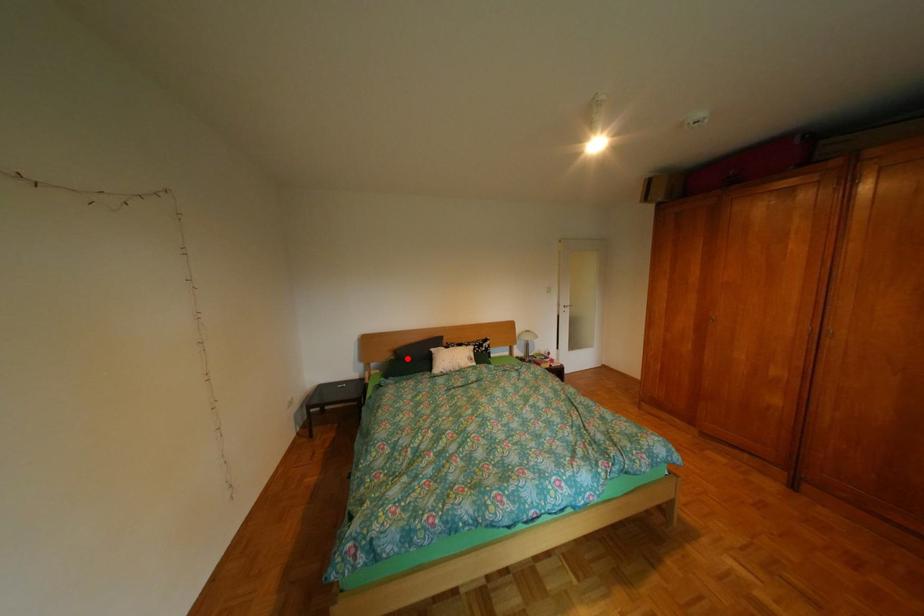
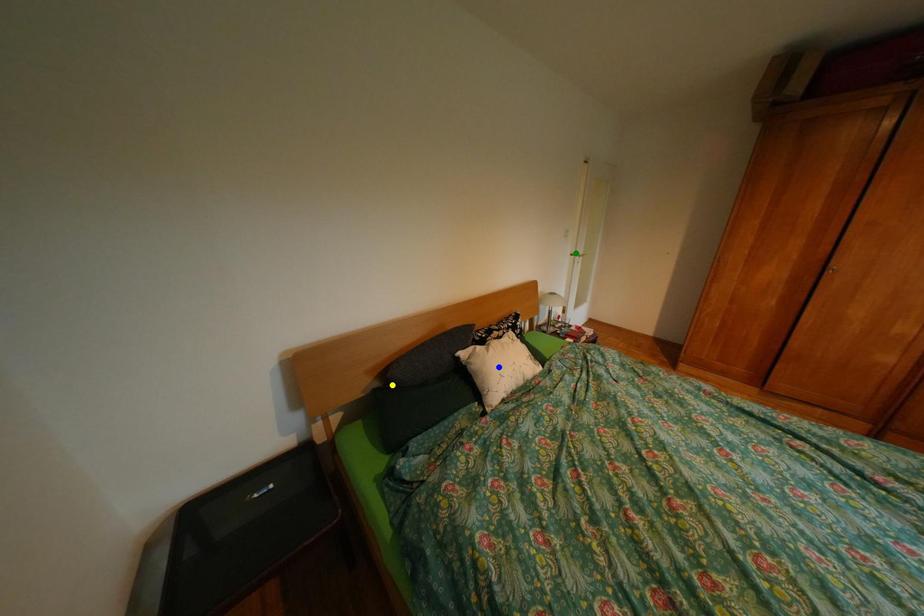
Question: I am providing you with two images of the same scene from different viewpoints. A red point is marked on the first image. You are given multiple points on the second image. Can you choose the point in image 2 that corresponds to the point in image 1?

Choices:
 (A) green point
 (B) yellow point
 (C) blue point

Answer: (B)